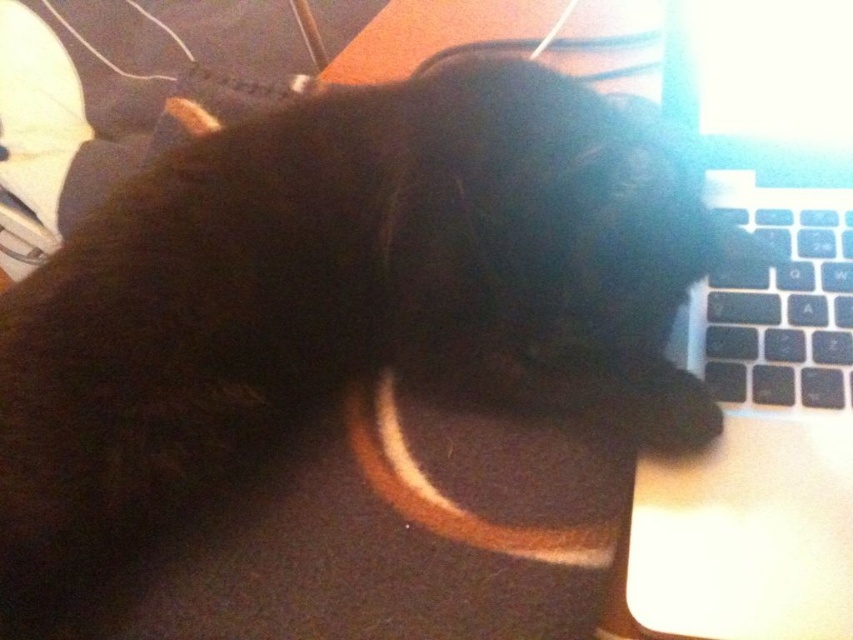
You are trying to locate the sleek black laptop at right in the image. According to the coordinates provided, where exactly is it positioned?

The sleek black laptop at right is located at point coordinates of (762, 339).

You are a photographer trying to capture the black cat lying on the dark surface. The sleek black laptop at right is in the background. To ensure the laptop doesn not distract from the cat, you want to move it to a different location. If you move the laptop to the left, will it be closer to the cat?

The sleek black laptop at right is currently at position point (762, 339). Moving it to the left would decrease its x coordinate, so yes, the laptop would be closer to the cat.

You are a photographer taking a picture of the black cat. You notice two points in the scene, point (x=740, y=112) and point (x=810, y=195). Which point is closer to your camera?

Point (x=740, y=112) is closer to the camera because it is further to the viewer than point (x=810, y=195).